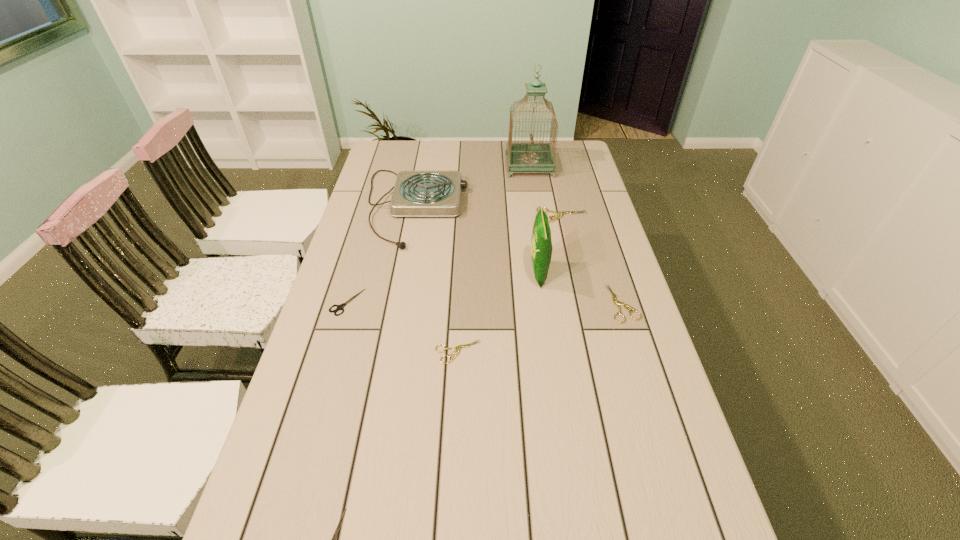
I want to click on the leftmost beige shears, so click(x=457, y=348).

You are a GUI agent. You are given a task and a screenshot of the screen. Output one action in this format:
    pyautogui.click(x=<x>, y=<y>)
    Task: Click on the second nearest shears
    
    Given the screenshot: What is the action you would take?
    coord(457,348)

I want to click on free location located 0.210m at the door of the greenish birdcage, so [x=455, y=166].

This screenshot has height=540, width=960. In order to click on vacant space located 0.170m at the door of the greenish birdcage in this screenshot , I will do `click(465, 166)`.

At what (x,y) coordinates should I click in order to perform the action: click on free space located 0.140m at the door of the greenish birdcage. Please return your answer as a coordinate pair (x, y). Looking at the image, I should click on (472, 166).

Locate an element on the screen. This screenshot has height=540, width=960. vacant space located 0.070m on the front-facing side of the seventh shortest object is located at coordinates (507, 273).

Identify the location of blank space located 0.090m on the front-facing side of the seventh shortest object. The image size is (960, 540). (500, 273).

Identify the location of blank space located on the front-facing side of the seventh shortest object. The image size is (960, 540). (493, 273).

Image resolution: width=960 pixels, height=540 pixels. Identify the location of vacant point located 0.200m with a retractable cable on the side of the sixth shortest object. (522, 207).

I want to click on vacant space located on the back of the farthest shears, so click(x=552, y=171).